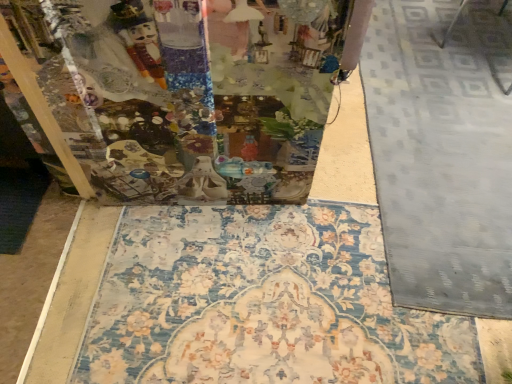
Where is `blank area beneath floral carpet at center (from a real-world perspective)`? This screenshot has width=512, height=384. blank area beneath floral carpet at center (from a real-world perspective) is located at coordinates (265, 294).